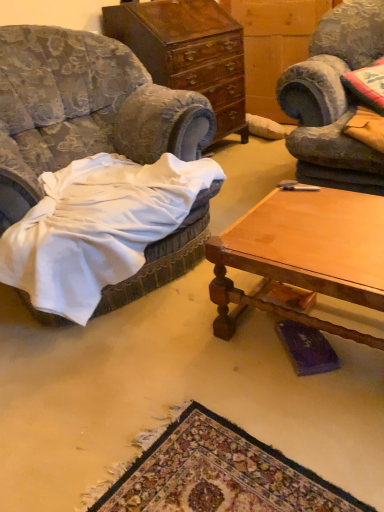
Question: From the image's perspective, is wooden polished coffee table at center positioned above or below polished wood cabinet at center?

Choices:
 (A) above
 (B) below

Answer: (B)

Question: Considering the positions of wooden polished coffee table at center and polished wood cabinet at center in the image, is wooden polished coffee table at center wider or thinner than polished wood cabinet at center?

Choices:
 (A) wide
 (B) thin

Answer: (A)

Question: Based on their relative distances, which object is farther from the wooden polished coffee table at center?

Choices:
 (A) velvet blue armchair at left
 (B) polished wood cabinet at center

Answer: (B)

Question: Which object is positioned farthest from the velvet blue armchair at left?

Choices:
 (A) polished wood cabinet at center
 (B) wooden polished coffee table at center

Answer: (A)